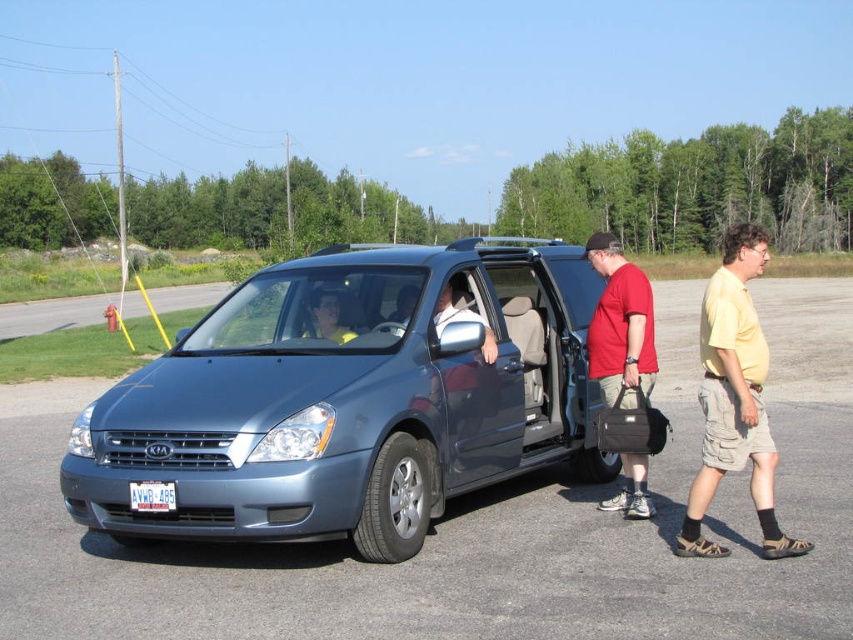
You are a delivery person who needs to park your delivery van next to the satin metallic minivan at center. The parking space has a width limit of 2 meters. If the white plastic license plate at center is 0.3 meters wide, can you safely park your van without exceeding the space?

The satin metallic minivan at center is wider than the white plastic license plate at center, which is 0.3 meters wide. Since the parking space has a 2 meters width limit, and the minivan is wider than 0.3 meters, but we don not know the exact width of the minivan. Therefore, it is uncertain whether the delivery van can safely park without exceeding the space.

You are a pedestrian standing on the sidewalk. You see the satin metallic minivan at center and the matte red shirt at center. Which object is closer to the ground?

The satin metallic minivan at center is closer to the ground because it is below the matte red shirt at center.